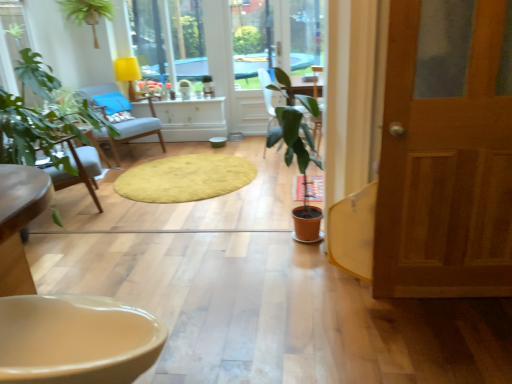
The image size is (512, 384). I want to click on free spot below wooden door at right (from a real-world perspective), so click(x=453, y=293).